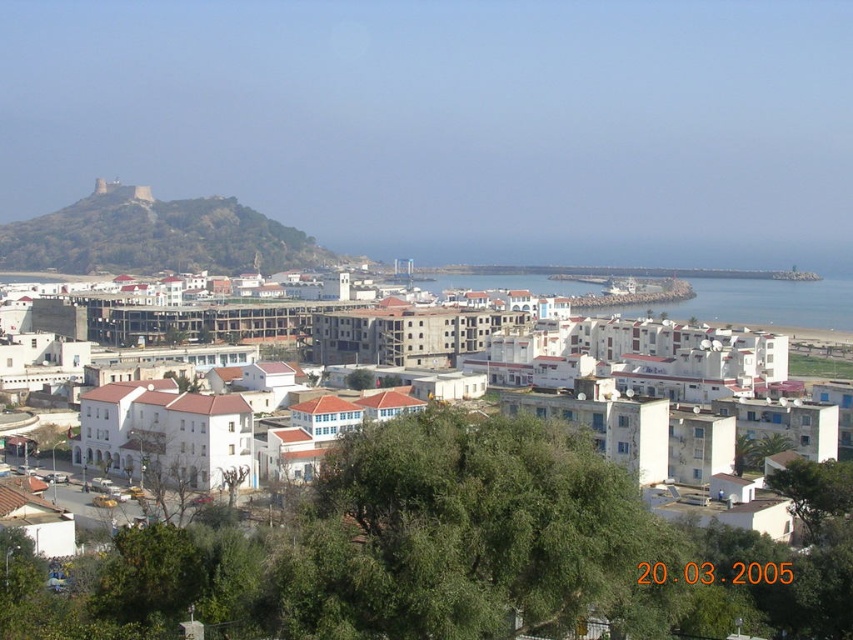
Question: Which point is farther to the camera?

Choices:
 (A) blue water at center
 (B) brown rocky hillside at upper left
 (C) white matte building at center

Answer: (B)

Question: Can you confirm if brown rocky hillside at upper left is wider than blue water at center?

Choices:
 (A) no
 (B) yes

Answer: (A)

Question: Which object is closer to the camera taking this photo?

Choices:
 (A) white matte building at center
 (B) blue water at center

Answer: (A)

Question: Does white matte building at center have a lesser width compared to blue water at center?

Choices:
 (A) no
 (B) yes

Answer: (A)

Question: Which point is farther to the camera?

Choices:
 (A) (714, 310)
 (B) (779, 312)

Answer: (A)

Question: Does brown rocky hillside at upper left have a larger size compared to blue water at center?

Choices:
 (A) yes
 (B) no

Answer: (A)